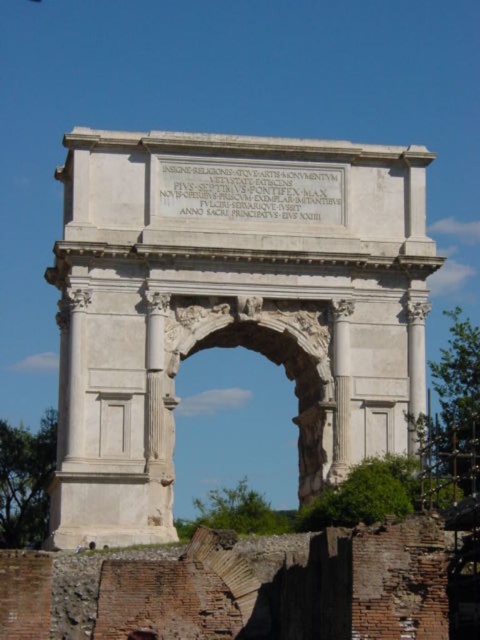
You are an architect examining the classical Roman structure. You observe the white stone arch at center and the white stone archway at center. Which of these two structures is larger in size?

The white stone arch at center is bigger than the white stone archway at center, so the white stone arch at center is larger in size.

You are a tourist standing at the base of the white stone arch at center. You want to take a photo of the arch with your smartphone, which has a maximum zoom range of 100 meters. Can you capture the entire arch in one photo without moving your position?

The distance between you and the white stone arch at center is 80.65 meters, which is within the smartphone camera maximum zoom range of 100 meters. Therefore, you can capture the entire arch in one photo without moving your position.

You are an architect designing a new plaza and want to replicate the spacing between the white stone arch at center and the white stone archway at center from the image. What is the exact distance you should maintain between them?

The exact distance between the white stone arch at center and the white stone archway at center is 13.08 feet, so you should maintain that exact distance in your plaza design.